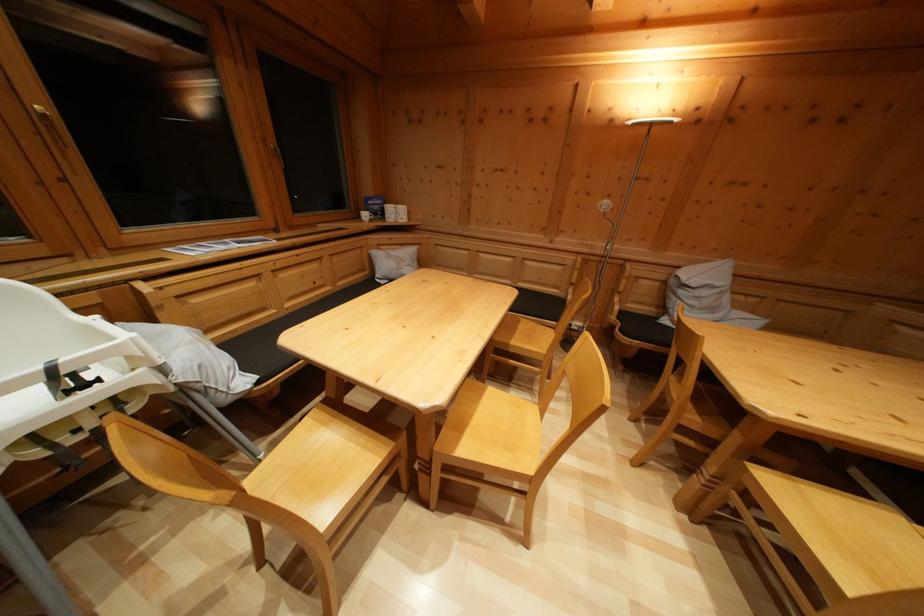
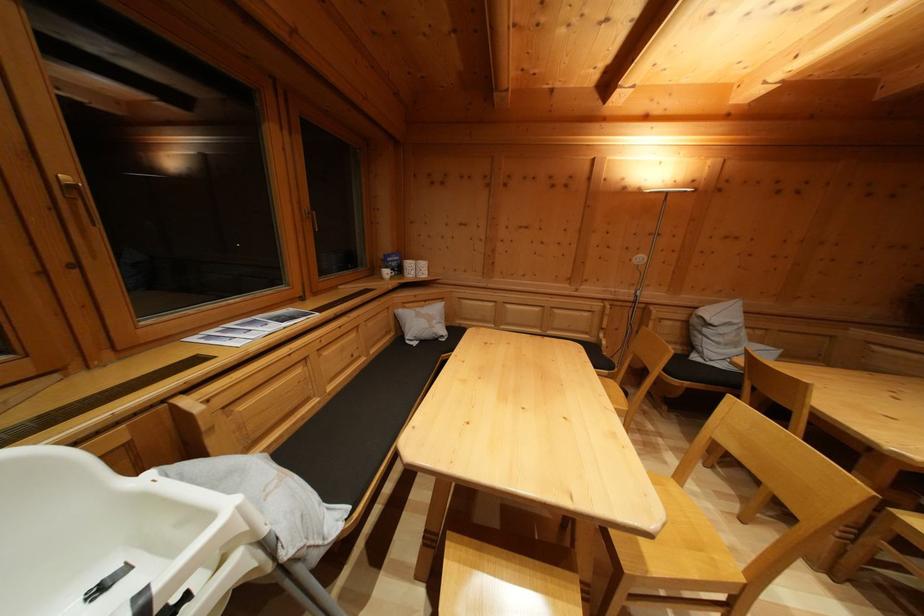
The point at (x=380, y=211) is marked in the first image. Where is the corresponding point in the second image?

(397, 268)